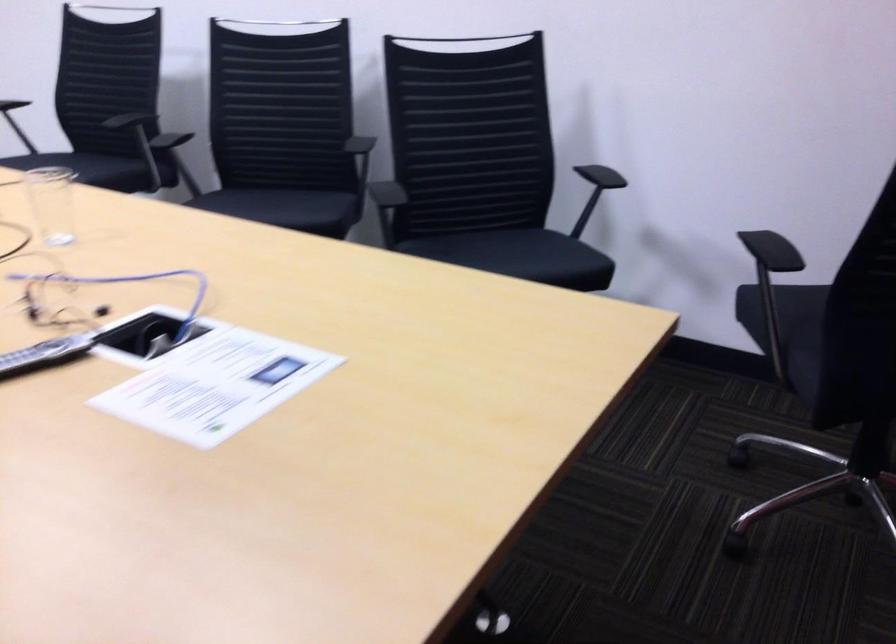
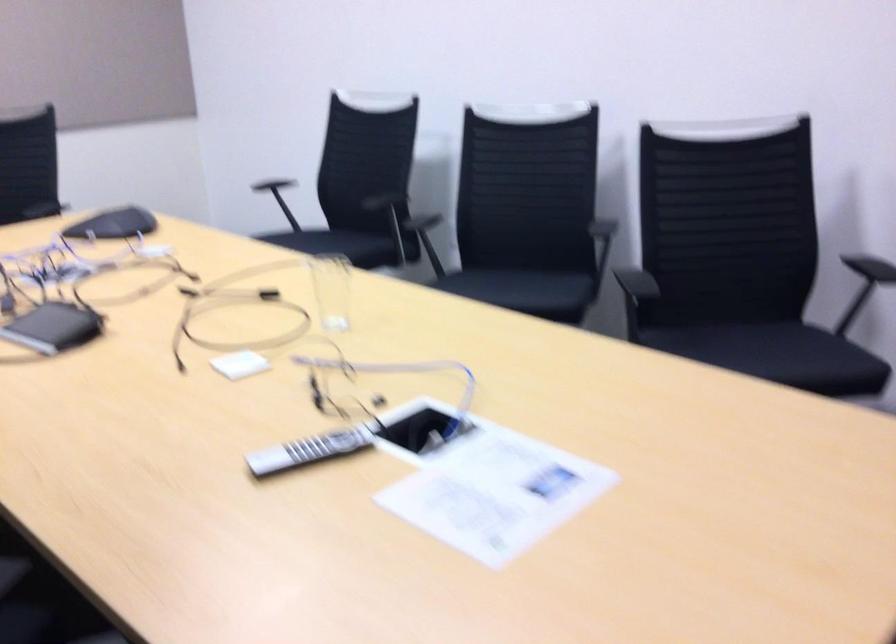
Question: Which direction would the cameraman need to move to produce the second image? Reply with the corresponding letter.

Choices:
 (A) Left
 (B) Right
 (C) Forward
 (D) Backward

Answer: (A)